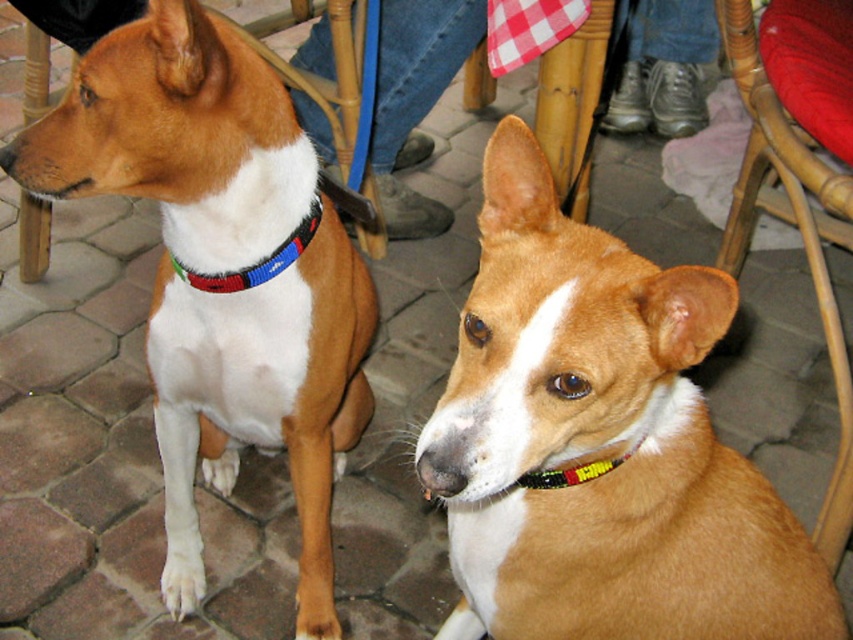
You are trying to decide where to place a new plant pot between the brown shiny dog at center and the woven wood chair at lower right. According to the scene, which object should the plant pot be placed to the right of?

The plant pot should be placed to the right of the brown shiny dog at center because the brown shiny dog at center is positioned on the left side of the woven wood chair at lower right.

You are standing at the point marked as point [325,81] in the image. What object is located exactly at this point?

The wooden chair at left is located exactly at point [325,81].